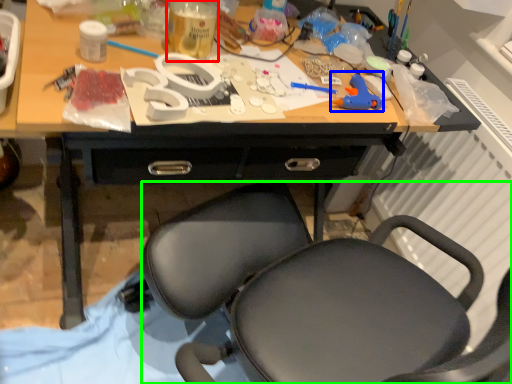
Question: Which object is positioned closest to bottle (highlighted by a red box)? Select from toy (highlighted by a blue box) and chair (highlighted by a green box).

Choices:
 (A) toy
 (B) chair

Answer: (A)